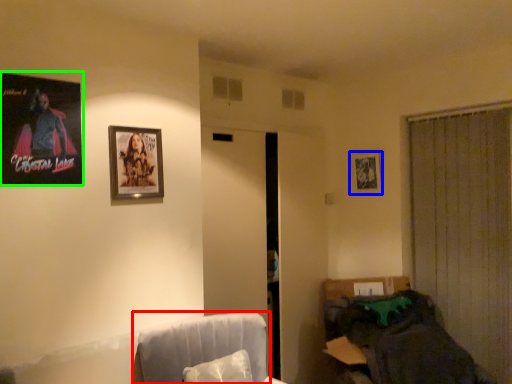
Question: Considering the real-world distances, which object is farthest from swivel chair (highlighted by a red box)? picture frame (highlighted by a blue box) or picture frame (highlighted by a green box)?

Choices:
 (A) picture frame
 (B) picture frame

Answer: (A)